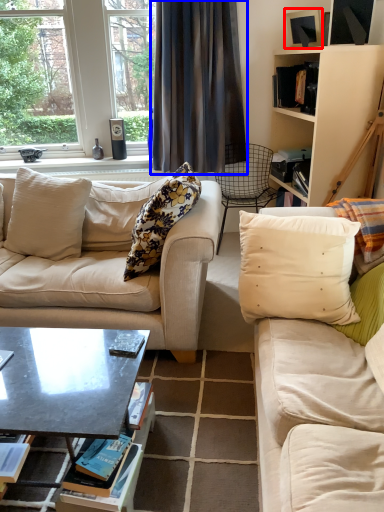
Question: Which point is closer to the camera, picture frame (highlighted by a red box) or curtain (highlighted by a blue box)?

Choices:
 (A) picture frame
 (B) curtain

Answer: (A)